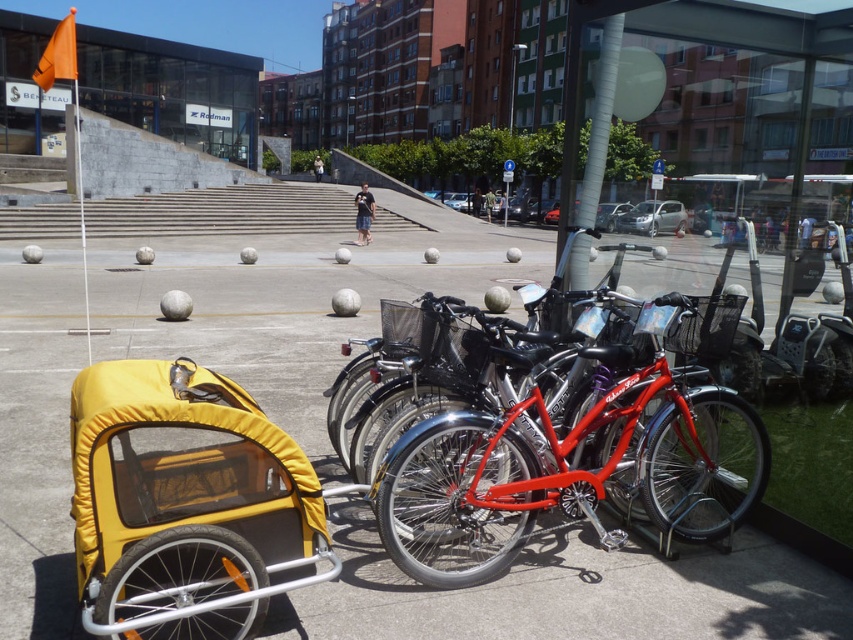
You are a delivery person needing to park your cargo bike trailer in the plaza. The yellow fabric baby carriage at lower left is currently occupying space. Can you fit your trailer next to the shiny metallic bicycle at center without overlapping?

The yellow fabric baby carriage at lower left has a lesser width compared to the shiny metallic bicycle at center. Since the baby carriage is narrower, there might be enough space next to the wider bicycle, but this depends on the total available space. However, without knowing the exact dimensions of the parking area, it is uncertain if they can fit side by side without overlapping.

You are a delivery person trying to park your bike between the gray concrete pavement at center and the shiny metallic bicycle at center. Can you fit your bike there if your bike is 1.2 meters wide?

The gray concrete pavement at center might be wider than shiny metallic bicycle at center, but the exact width isn t specified. Without knowing the exact width of the pavement, it s uncertain if your 1.2 meter wide bike will fit. Check the available space before attempting to park.

You are a parent pushing a stroller through the plaza. You see the gray concrete pavement at center and the yellow fabric baby carriage at lower left. Which surface would be better for pushing the stroller smoothly?

The gray concrete pavement at center is taller than the yellow fabric baby carriage at lower left, so pushing the stroller on the gray concrete pavement at center would be smoother as it provides a more level surface.